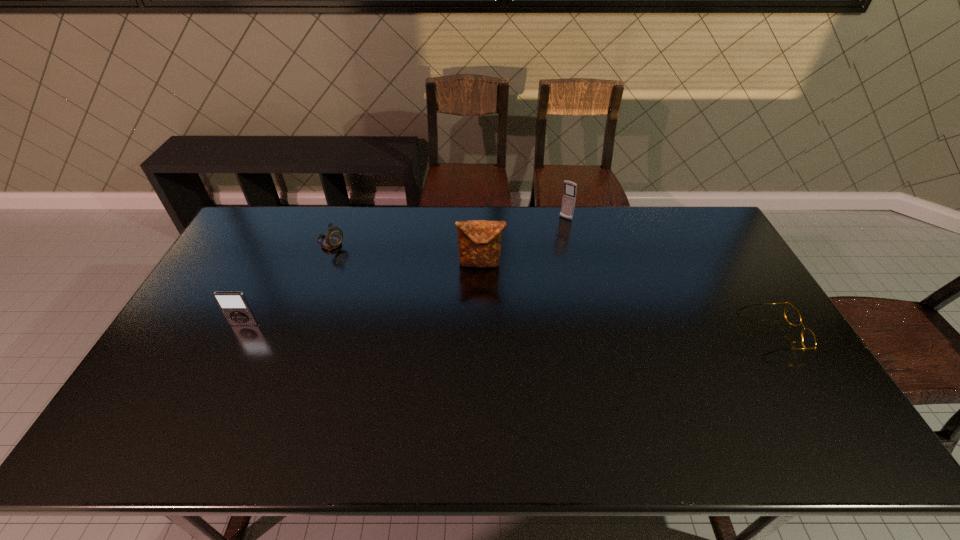
Locate which object ranks in proximity to the farthest object. Please provide its 2D coordinates. Your answer should be formatted as a tuple, i.e. [(x, y)], where the tuple contains the x and y coordinates of a point satisfying the conditions above.

[(479, 241)]

I want to click on free space that satisfies the following two spatial constraints: 1. on the front-facing side of the rightmost object; 2. on the front-facing side of the leftmost object, so click(x=240, y=333).

This screenshot has height=540, width=960. I want to click on free location that satisfies the following two spatial constraints: 1. on the front-facing side of the spectacles; 2. on the front-facing side of the leftmost object, so click(240, 333).

This screenshot has height=540, width=960. I want to click on vacant region that satisfies the following two spatial constraints: 1. on the front-facing side of the rightmost object; 2. on the front-facing side of the third shortest object, so click(x=240, y=333).

In order to click on blank area in the image that satisfies the following two spatial constraints: 1. on the front-facing side of the shortest object; 2. on the front-facing side of the iPod in this screenshot , I will do `click(240, 333)`.

At what (x,y) coordinates should I click in order to perform the action: click on vacant area in the image that satisfies the following two spatial constraints: 1. on the front-facing side of the third tallest object; 2. on the front-facing side of the shortest object. Please return your answer as a coordinate pair (x, y). This screenshot has width=960, height=540. Looking at the image, I should click on (240, 333).

The image size is (960, 540). In order to click on free space that satisfies the following two spatial constraints: 1. on the front-facing side of the leftmost object; 2. on the front-facing side of the shortest object in this screenshot , I will do `click(240, 333)`.

In order to click on vacant space that satisfies the following two spatial constraints: 1. on the front-facing side of the iPod; 2. on the front-facing side of the spectacles in this screenshot , I will do pyautogui.click(x=240, y=333).

This screenshot has height=540, width=960. In order to click on vacant space that satisfies the following two spatial constraints: 1. on the front-facing side of the iPod; 2. on the front-facing side of the shortest object in this screenshot , I will do [240, 333].